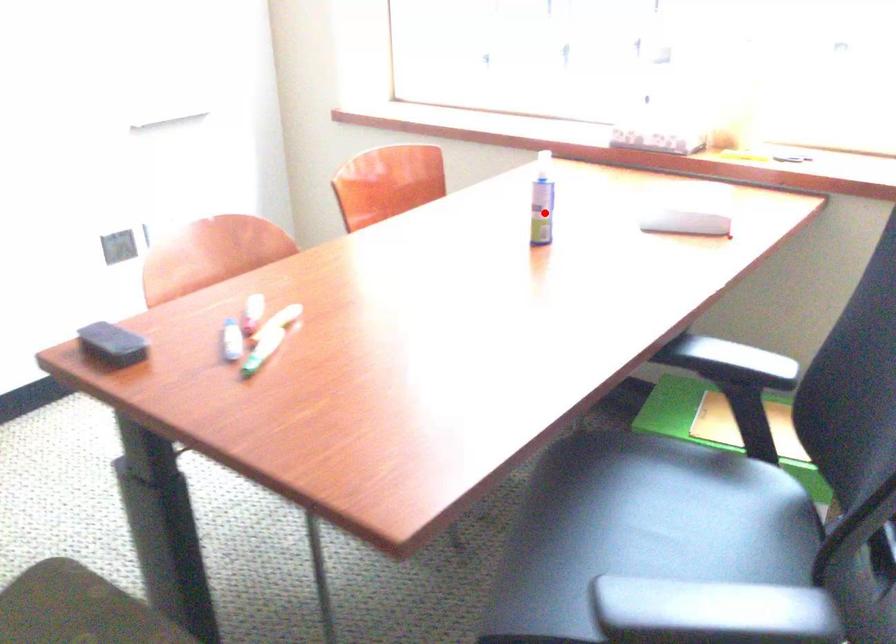
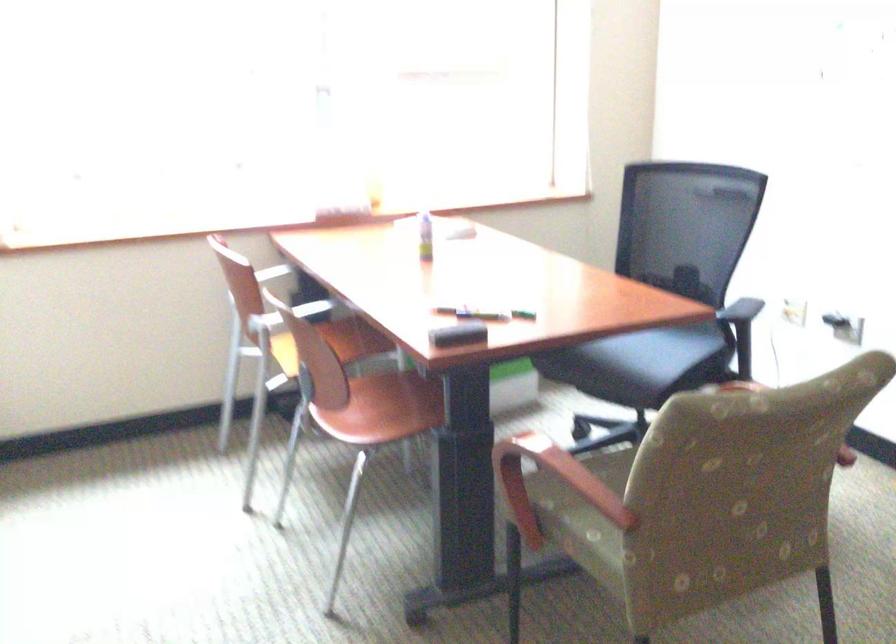
Question: I am providing you with two images of the same scene from different viewpoints. In image1, a red point is highlighted. Considering the same 3D point in image2, which of the following is correct?

Choices:
 (A) It is closer
 (B) It is farther

Answer: (B)